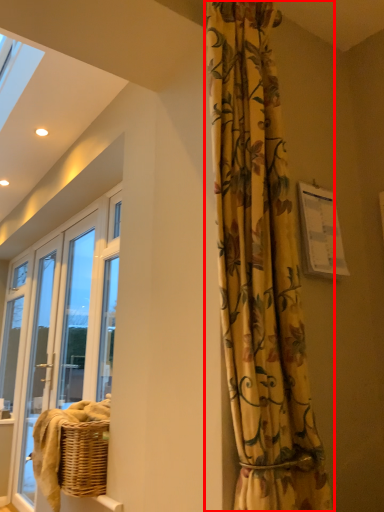
Question: From the image's perspective, considering the relative positions of curtain (annotated by the red box) and screen door in the image provided, where is curtain (annotated by the red box) located with respect to the staircase?

Choices:
 (A) below
 (B) above

Answer: (B)